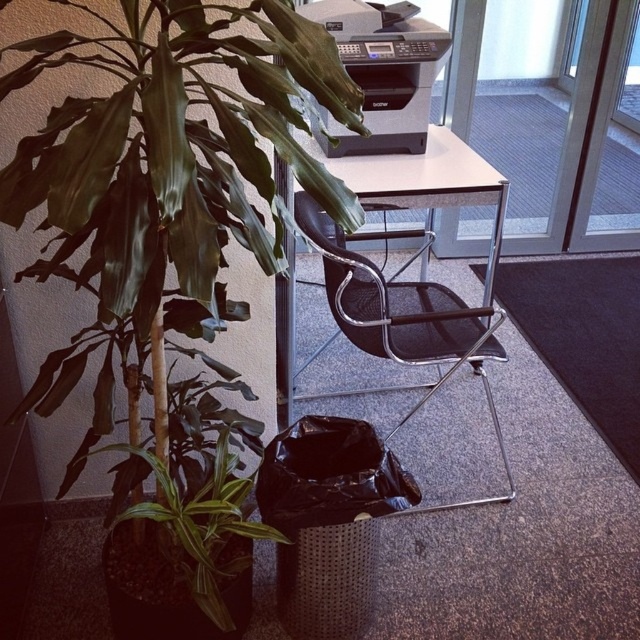
You are an office worker who needs to reach the black plastic printer at upper center from your current position near the black mesh swivel chair at center. Which direction should you move to reach the printer?

The black mesh swivel chair at center is to the right of the black plastic printer at upper center, so you should move to the left to reach the printer.